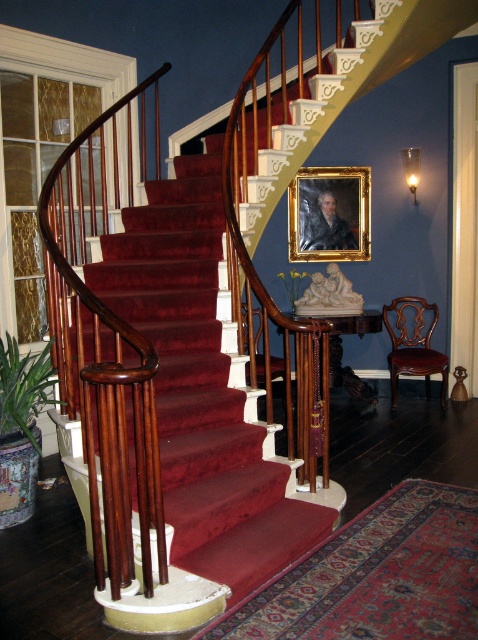
Question: Is mahogany wood railing at left smaller than goldwooden frame at center?

Choices:
 (A) no
 (B) yes

Answer: (A)

Question: Which point is closer to the camera taking this photo?

Choices:
 (A) (310, 182)
 (B) (94, 237)
 (C) (96, 204)

Answer: (B)

Question: Does mahogany wood stairs at center appear on the right side of goldwooden frame at center?

Choices:
 (A) no
 (B) yes

Answer: (A)

Question: Based on their relative distances, which object is farther from the goldwooden frame at center?

Choices:
 (A) mahogany wood railing at left
 (B) mahogany wood stairs at center

Answer: (A)

Question: Is mahogany wood railing at left positioned before goldwooden frame at center?

Choices:
 (A) no
 (B) yes

Answer: (B)

Question: Which object is closer to the camera taking this photo?

Choices:
 (A) mahogany wood stairs at center
 (B) mahogany wood railing at left

Answer: (B)